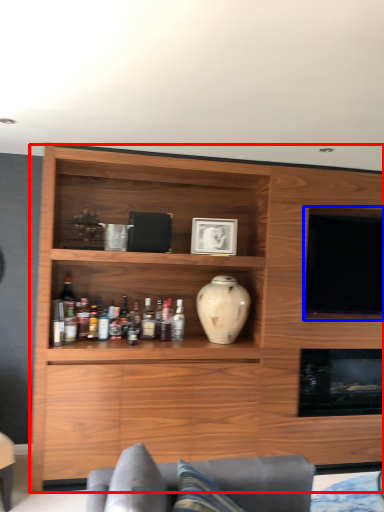
Question: Which object appears farthest to the camera in this image, cabinetry (highlighted by a red box) or television (highlighted by a blue box)?

Choices:
 (A) cabinetry
 (B) television

Answer: (B)